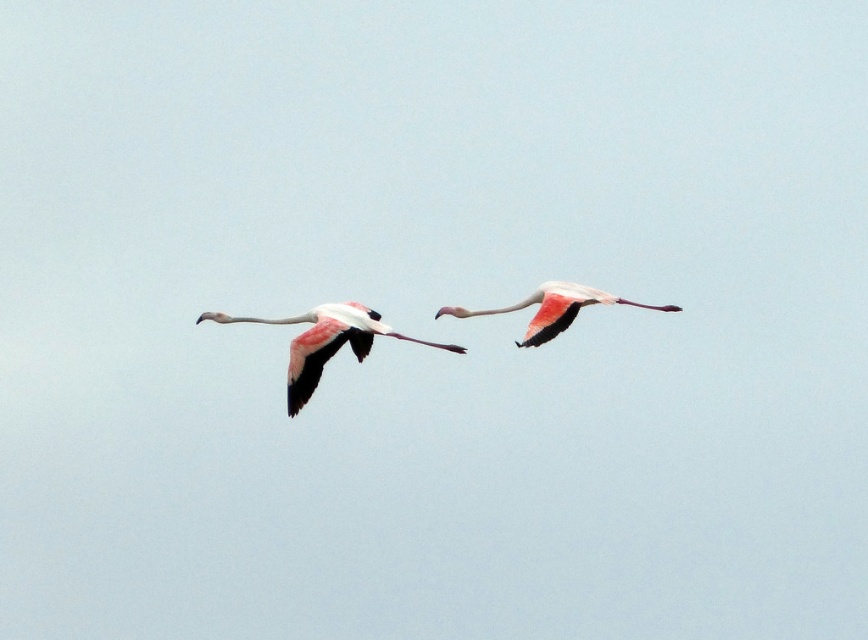
You are a wildlife photographer aiming to capture a closeup shot of the pink feathered flamingo at center. Your camera has a maximum zoom range of 30 meters. Can you get a clear closeup without moving closer?

The pink feathered flamingo at center is 33.43 meters away from the camera, which exceeds the camera maximum zoom range of 30 meters. Therefore, you cannot get a clear closeup without moving closer.

You are an ornithologist observing two flamingos in flight against a pale blue sky. You notice both the pink feathered flamingo at center and the pink matte flamingo at center. Which of these two flamingos has a more slender body shape?

The pink feathered flamingo at center is thinner than the pink matte flamingo at center, so the pink feathered flamingo at center has a more slender body shape.

You are a birdwatcher trying to locate the pink feathered flamingo at center in the image. What are the coordinates where you should focus your binoculars?

The pink feathered flamingo at center is located at coordinates point (324, 342).